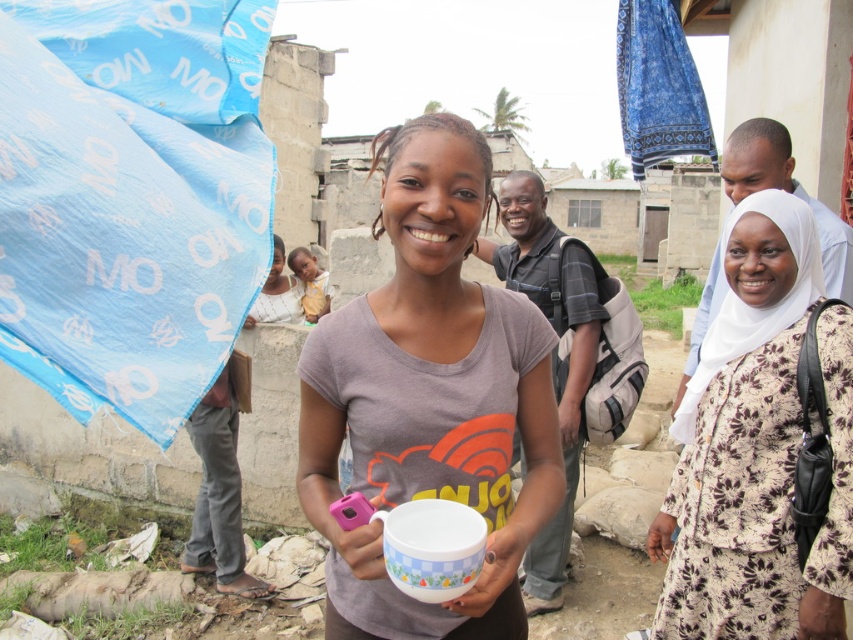
Question: Is white floral dress at center wider than yellow fabric baby at center?

Choices:
 (A) yes
 (B) no

Answer: (A)

Question: Is white glossy mug at center to the right of white floral dress at center from the viewer's perspective?

Choices:
 (A) yes
 (B) no

Answer: (B)

Question: Does white glossy mug at center lie behind yellow fabric baby at center?

Choices:
 (A) no
 (B) yes

Answer: (A)

Question: Which point is closer to the camera taking this photo?

Choices:
 (A) (404, 211)
 (B) (317, 296)

Answer: (A)

Question: Which point is closer to the camera taking this photo?

Choices:
 (A) (306, 305)
 (B) (695, 442)
 (C) (471, 369)

Answer: (C)

Question: Which point is farther from the camera taking this photo?

Choices:
 (A) (790, 225)
 (B) (317, 396)

Answer: (A)